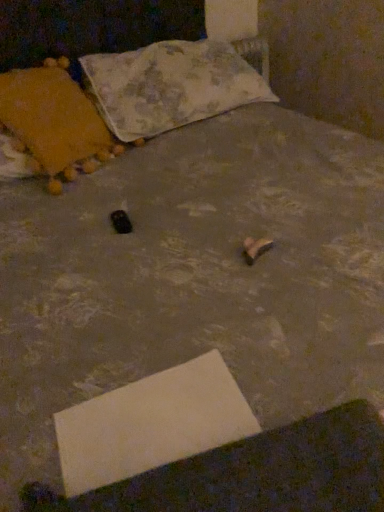
Question: From a real-world perspective, is white cardboard at lower center physically below fluffy fabric pillow at upper center, placed as the first pillow when sorted from right to left?

Choices:
 (A) no
 (B) yes

Answer: (B)

Question: Is white cardboard at lower center thinner than fluffy fabric pillow at upper center, the second pillow from the left?

Choices:
 (A) yes
 (B) no

Answer: (A)

Question: Is white cardboard at lower center closer to the viewer compared to fluffy fabric pillow at upper center, placed as the first pillow when sorted from right to left?

Choices:
 (A) yes
 (B) no

Answer: (A)

Question: Is white cardboard at lower center surrounding fluffy fabric pillow at upper center, the second pillow from the left?

Choices:
 (A) yes
 (B) no

Answer: (B)

Question: Is white cardboard at lower center looking in the opposite direction of fluffy fabric pillow at upper center, placed as the first pillow when sorted from right to left?

Choices:
 (A) yes
 (B) no

Answer: (B)

Question: Is white cardboard at lower center aimed at fluffy fabric pillow at upper center, placed as the first pillow when sorted from right to left?

Choices:
 (A) no
 (B) yes

Answer: (A)

Question: Considering the relative sizes of fluffy fabric pillow at upper center, placed as the first pillow when sorted from right to left, and white cardboard at lower center in the image provided, is fluffy fabric pillow at upper center, placed as the first pillow when sorted from right to left, smaller than white cardboard at lower center?

Choices:
 (A) yes
 (B) no

Answer: (B)

Question: Does fluffy fabric pillow at upper center, placed as the first pillow when sorted from right to left, have a greater height compared to white cardboard at lower center?

Choices:
 (A) yes
 (B) no

Answer: (A)

Question: Is the depth of fluffy fabric pillow at upper center, the second pillow from the left, less than that of white cardboard at lower center?

Choices:
 (A) no
 (B) yes

Answer: (A)

Question: Can you confirm if fluffy fabric pillow at upper center, the second pillow from the left, is thinner than white cardboard at lower center?

Choices:
 (A) yes
 (B) no

Answer: (B)

Question: From a real-world perspective, is fluffy fabric pillow at upper center, the second pillow from the left, below white cardboard at lower center?

Choices:
 (A) no
 (B) yes

Answer: (A)

Question: From the image's perspective, is fluffy fabric pillow at upper center, placed as the first pillow when sorted from right to left, on white cardboard at lower center?

Choices:
 (A) no
 (B) yes

Answer: (B)

Question: From a real-world perspective, is velvet orange pillow at left, acting as the 1th pillow starting from the left, on top of white cardboard at lower center?

Choices:
 (A) no
 (B) yes

Answer: (B)